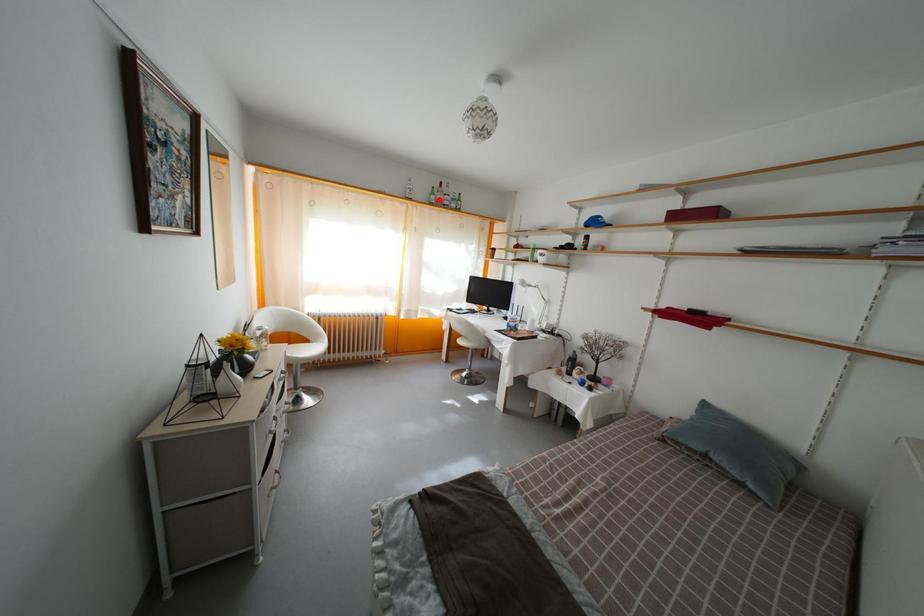
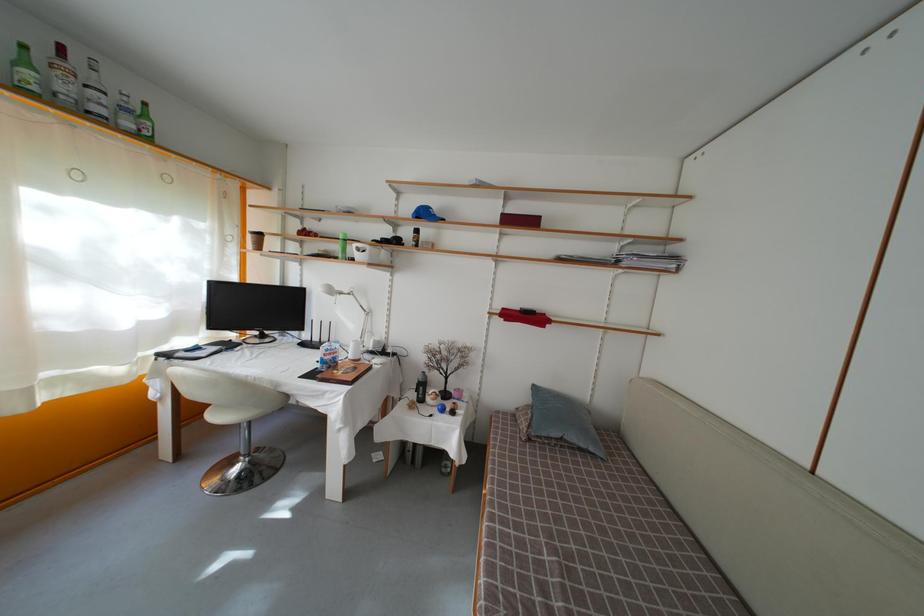
Question: A red point is marked in image1. In image2, is the corresponding 3D point closer to the camera or farther? Reply with the corresponding letter.

Choices:
 (A) The corresponding 3D point is closer.
 (B) The corresponding 3D point is farther.

Answer: (B)